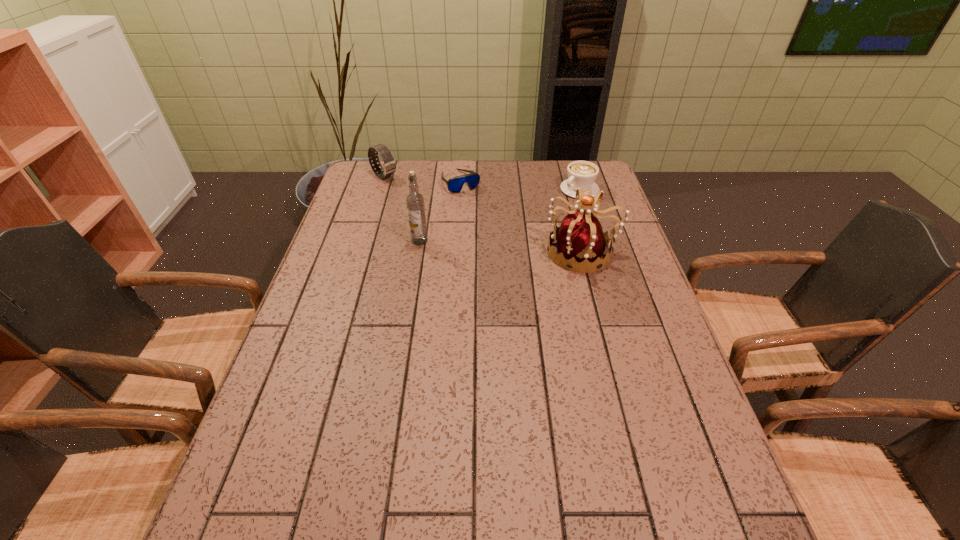
I want to click on vodka, so click(x=415, y=203).

You are a GUI agent. You are given a task and a screenshot of the screen. Output one action in this format:
    pyautogui.click(x=<x>, y=<y>)
    Task: Click on the tiara
    The width and height of the screenshot is (960, 540).
    Given the screenshot: What is the action you would take?
    pyautogui.click(x=581, y=240)

At what (x,y) coordinates should I click in order to perform the action: click on cappuccino. Please return your answer as a coordinate pair (x, y). The height and width of the screenshot is (540, 960). Looking at the image, I should click on (581, 174).

Locate an element on the screen. The height and width of the screenshot is (540, 960). the third object from right to left is located at coordinates (455, 184).

Where is `sunglasses`? The image size is (960, 540). sunglasses is located at coordinates (455, 184).

Where is `the third shortest object`? The height and width of the screenshot is (540, 960). the third shortest object is located at coordinates (389, 165).

Where is `the leftmost object`? The height and width of the screenshot is (540, 960). the leftmost object is located at coordinates tap(389, 165).

The height and width of the screenshot is (540, 960). I want to click on vacant space situated on the label of the vodka, so click(365, 241).

This screenshot has height=540, width=960. I want to click on free spot located on the label of the vodka, so click(332, 241).

Find the location of a particular element. vacant area situated 0.130m on the label of the vodka is located at coordinates (369, 241).